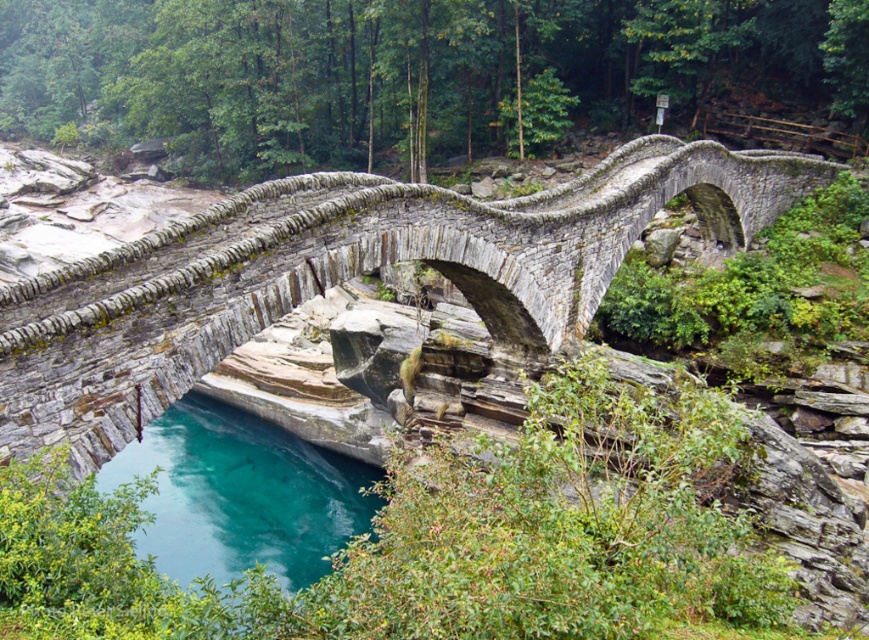
Who is more forward, [499,276] or [180,518]?

Point [499,276] is in front.

Where is `gray stone bridge at center`? gray stone bridge at center is located at coordinates (345, 275).

Locate an element on the screen. Image resolution: width=869 pixels, height=640 pixels. gray stone bridge at center is located at coordinates (345, 275).